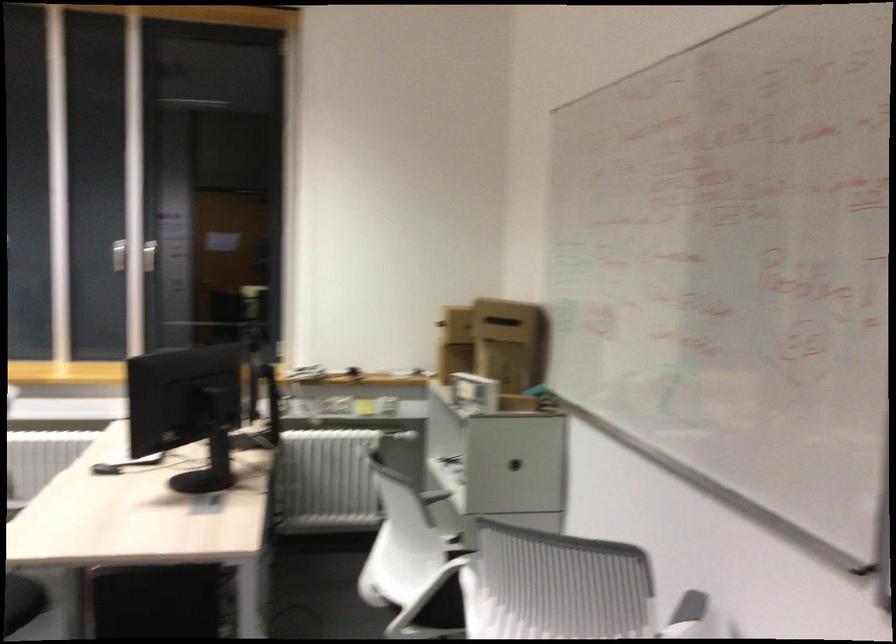
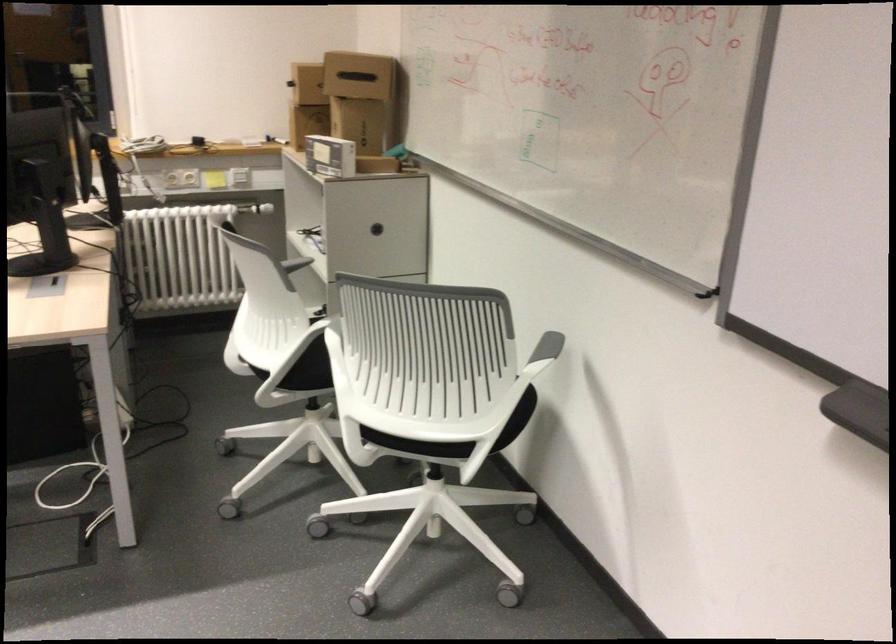
The point at (x=495, y=308) is marked in the first image. Where is the corresponding point in the second image?

(358, 75)